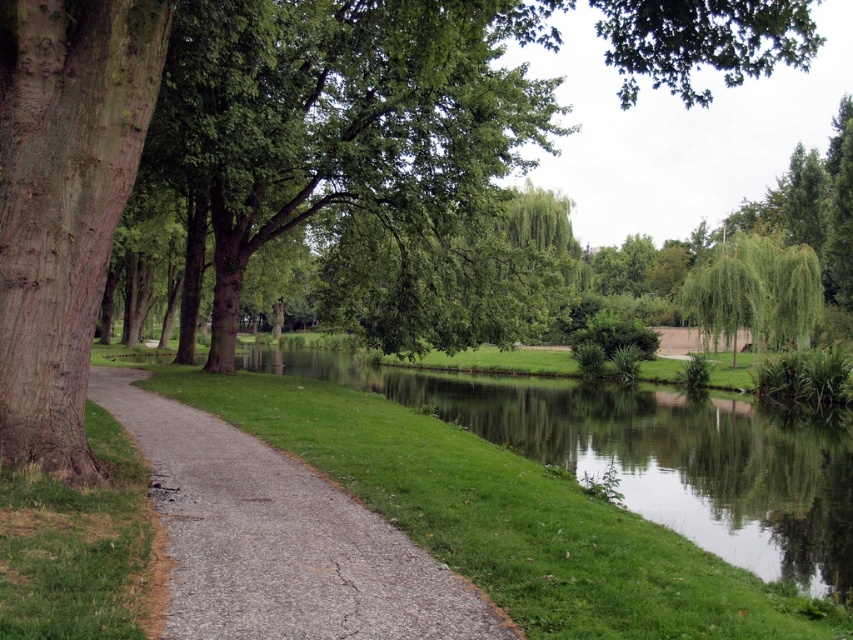
Is point (146, 147) closer to viewer compared to point (238, 435)?

No, (146, 147) is behind (238, 435).

Is green leafy tree at upper left smaller than gray asphalt path at center?

No.

Who is more forward, (289,216) or (258,628)?

Point (258,628) is in front.

At what (x,y) coordinates should I click in order to perform the action: click on green leafy tree at upper left. Please return your answer as a coordinate pair (x, y). The width and height of the screenshot is (853, 640). Looking at the image, I should click on (337, 116).

Consider the image. Which is below, green leafy tree at left or gray asphalt path at center?

gray asphalt path at center is lower down.

Does green leafy tree at left appear on the left side of gray asphalt path at center?

In fact, green leafy tree at left is to the right of gray asphalt path at center.

In the scene shown: Who is more forward, (1,170) or (341,608)?

Point (341,608)

Identify the location of green leafy tree at left. The image size is (853, 640). (64, 200).

Consider the image. Between green leafy tree at left and smooth brown bark at left, which one appears on the right side from the viewer's perspective?

From the viewer's perspective, green leafy tree at left appears more on the right side.

Which is more to the left, green leafy tree at left or smooth brown bark at left?

Positioned to the left is smooth brown bark at left.

Image resolution: width=853 pixels, height=640 pixels. In order to click on green leafy tree at left in this screenshot , I will do `click(64, 200)`.